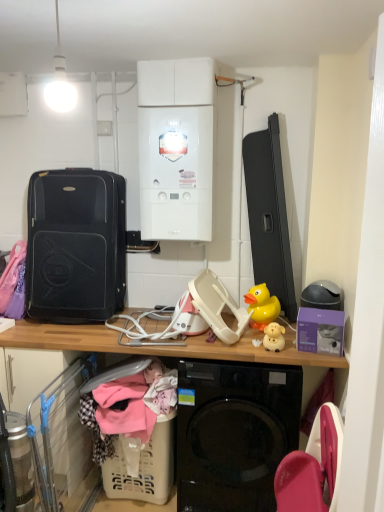
Question: Looking at the image, does beige plastic laundry basket at lower left seem bigger or smaller compared to wooden desk at center?

Choices:
 (A) big
 (B) small

Answer: (B)

Question: From the image's perspective, relative to wooden desk at center, is beige plastic laundry basket at lower left above or below?

Choices:
 (A) below
 (B) above

Answer: (A)

Question: Which is nearer to the beige plastic laundry basket at lower left?

Choices:
 (A) soft cotton clothes at lower center
 (B) matte yellow plastic toy at center, which is counted as the 1th toy, starting from the front
 (C) white glossy boiler at upper center
 (D) yellow rubber duck at upper right, positioned as the 1th toy in back-to-front order
 (E) wooden desk at center

Answer: (A)

Question: Which object is the closest to the black hardshell suitcase at left?

Choices:
 (A) soft cotton clothes at lower center
 (B) beige plastic laundry basket at lower left
 (C) white glossy boiler at upper center
 (D) wooden desk at center
 (E) yellow rubber duck at upper right, which appears as the 2th toy when viewed from the front

Answer: (C)